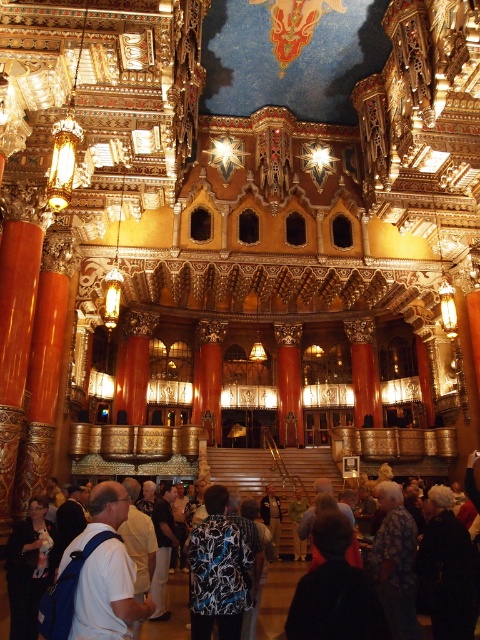
Question: Which point is farther to the camera?

Choices:
 (A) black fabric at lower right
 (B) floral print shirt at lower center

Answer: (B)

Question: Is black fabric at lower center smaller than dark blue shirt at center?

Choices:
 (A) yes
 (B) no

Answer: (A)

Question: Estimate the real-world distances between objects in this image. Which object is closer to the black fabric at lower center?

Choices:
 (A) floral print shirt at lower center
 (B) matte black jacket at lower left

Answer: (A)

Question: Considering the real-world distances, which object is farthest from the dark blue shirt at center?

Choices:
 (A) white fabric shirt at center
 (B) floral-patterned shirt at center
 (C) black fabric at lower center
 (D) floral print shirt at lower center

Answer: (D)

Question: Can you confirm if white fabric shirt at center is positioned below floral-patterned shirt at center?

Choices:
 (A) yes
 (B) no

Answer: (B)

Question: Does black fabric at lower center have a smaller size compared to black fabric at lower right?

Choices:
 (A) yes
 (B) no

Answer: (A)